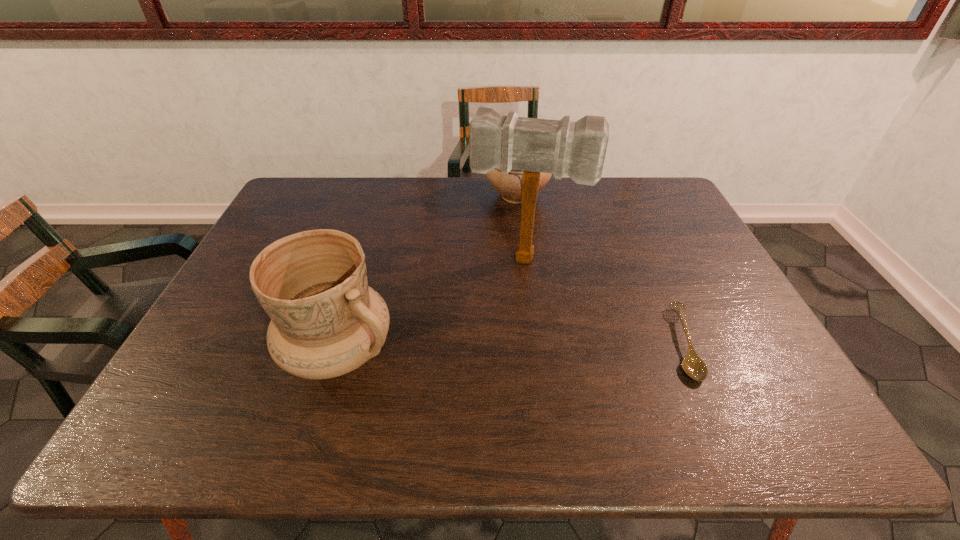
Locate an element on the screen. free space located 0.210m on the front-facing side of the farthest object is located at coordinates (524, 253).

I want to click on free region located at the head of the tallest object, so click(x=506, y=321).

The width and height of the screenshot is (960, 540). I want to click on vacant position located at the head of the tallest object, so click(511, 299).

Identify the location of vacant region located 0.250m at the head of the tallest object. (500, 345).

You are a GUI agent. You are given a task and a screenshot of the screen. Output one action in this format:
    pyautogui.click(x=<x>, y=<y>)
    Task: Click on the object at the far edge
    
    Given the screenshot: What is the action you would take?
    pyautogui.click(x=509, y=186)

What are the coordinates of `pottery positioned at the near edge` in the screenshot? It's located at (326, 321).

You are a GUI agent. You are given a task and a screenshot of the screen. Output one action in this format:
    pyautogui.click(x=<x>, y=<y>)
    Task: Click on the ladle that is at the near edge
    The image size is (960, 540).
    Given the screenshot: What is the action you would take?
    pyautogui.click(x=694, y=367)

Locate an element on the screen. The width and height of the screenshot is (960, 540). object present at the right edge is located at coordinates (694, 367).

Locate an element on the screen. object that is positioned at the near right corner is located at coordinates (694, 367).

Image resolution: width=960 pixels, height=540 pixels. In the image, there is a desktop. In order to click on free region at the far edge in this screenshot , I will do `click(330, 204)`.